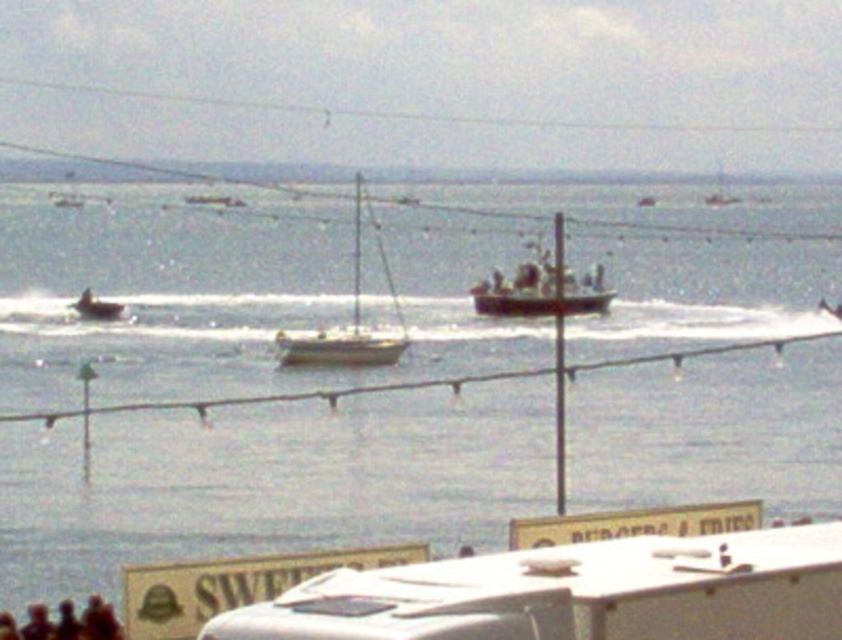
You are standing at the fence with string lights and want to look at two points in the image. The first point is point (94, 298) and the second point is point (727, 198). Which point is closer to you?

Point (94, 298) is in front of point (727, 198), so the first point is closer to you.

You are a pedestrian standing at the edge of the coastal promenade. You see the white matte trailer truck at lower center and the smooth white boat at left. Which object is closer to you?

The white matte trailer truck at lower center is closer to you because it is positioned in front of the smooth white boat at left.

You are planning to park your new car in the parking lot near the coast. The parking spot you found can only accommodate vehicles that take up less space than the white matte trailer truck at lower center. Do you think your car will fit in the parking spot if you compare it to the smooth white boat at left?

The white matte trailer truck at lower center occupies less space than the smooth white boat at left. Since the parking spot can only accommodate vehicles smaller than the trailer truck, your car must be even smaller than the trailer truck to fit. Comparing it to the boat, which is larger, doesn